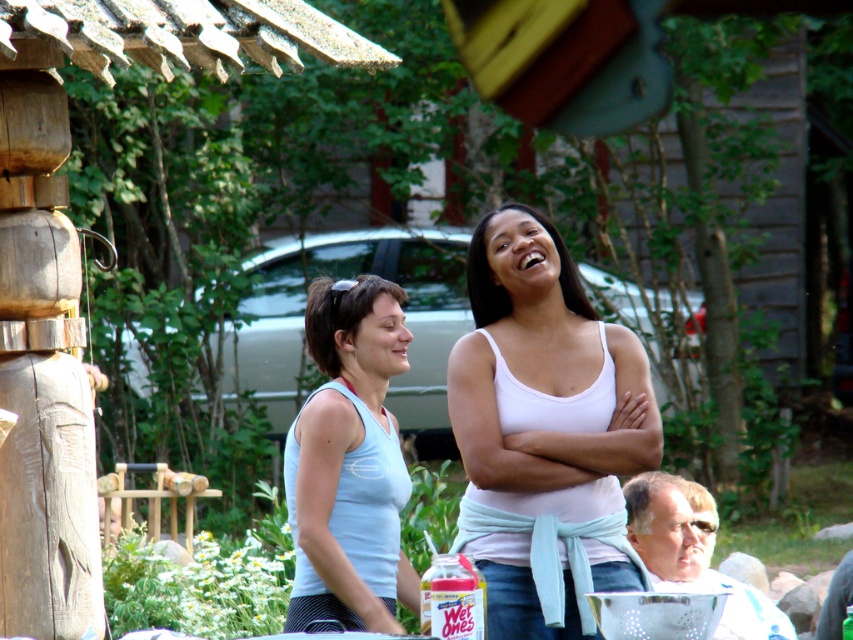
Consider the image. Can you confirm if white matte tank top at center is smaller than light blue fabric tank top at center?

Incorrect, white matte tank top at center is not smaller in size than light blue fabric tank top at center.

Which is behind, point (527, 225) or point (314, 285)?

The point (314, 285) is behind.

This screenshot has height=640, width=853. In order to click on white matte tank top at center in this screenshot , I will do `click(544, 429)`.